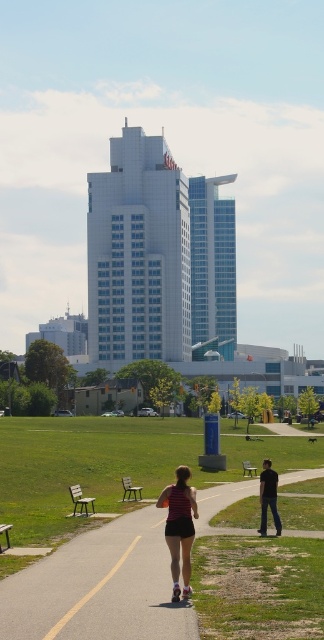
Is green wooden bench at lower left to the right of wooden park bench at center from the viewer's perspective?

In fact, green wooden bench at lower left is to the left of wooden park bench at center.

Between point (87, 513) and point (243, 474), which one is positioned behind?

The point (243, 474) is more distant.

Measure the distance between green wooden bench at lower left and camera.

green wooden bench at lower left and camera are 77.43 feet apart.

Identify the location of green wooden bench at lower left. The height and width of the screenshot is (640, 324). (81, 499).

Which is more to the left, asphalt path at center or wooden park bench at lower left?

wooden park bench at lower left is more to the left.

Measure the distance between point (287, 531) and camera.

Point (287, 531) and camera are 21.09 meters apart.

Identify the location of asphalt path at center. This screenshot has width=324, height=640. (99, 588).

Which is below, red fabric shorts at center or wooden park bench at center?

wooden park bench at center is below.

Describe the element at coordinates (180, 528) in the screenshot. I see `red fabric shorts at center` at that location.

I want to click on red fabric shorts at center, so click(180, 528).